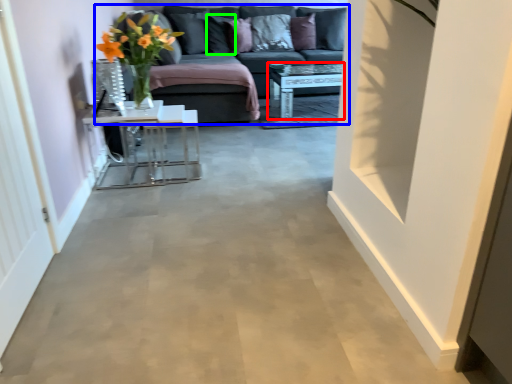
Question: Which object is the closest to the table (highlighted by a red box)? Choose among these: studio couch (highlighted by a blue box) or pillow (highlighted by a green box).

Choices:
 (A) studio couch
 (B) pillow

Answer: (A)